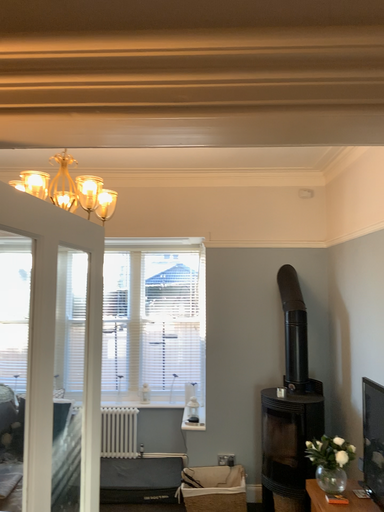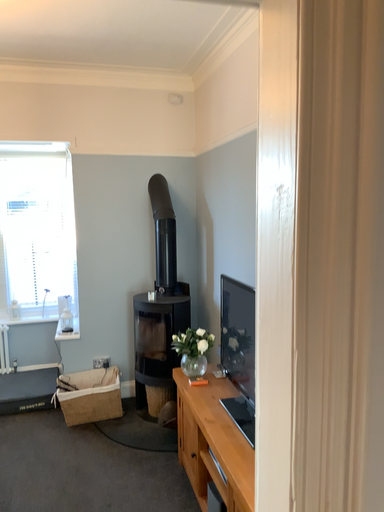
Question: How did the camera likely rotate when shooting the video?

Choices:
 (A) rotated left
 (B) rotated right

Answer: (B)